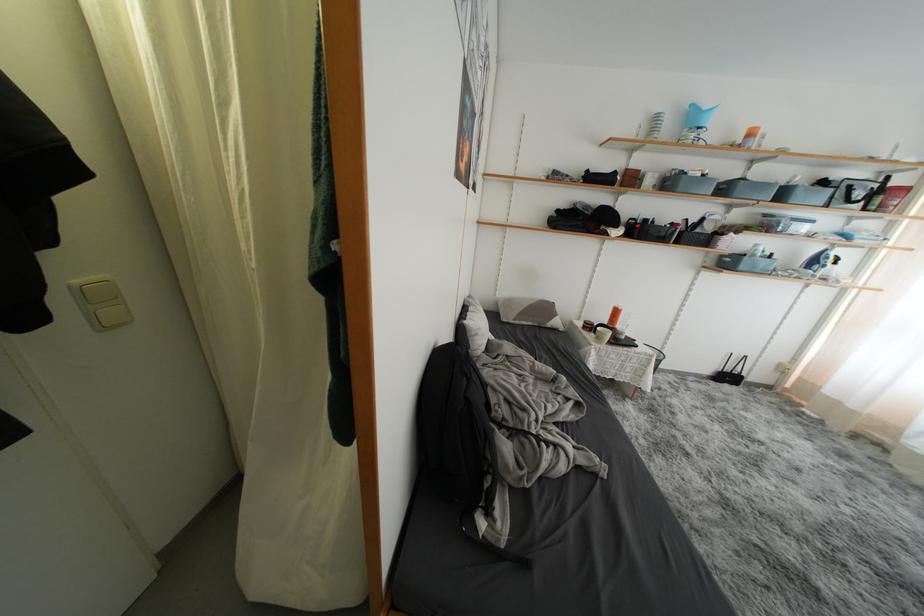
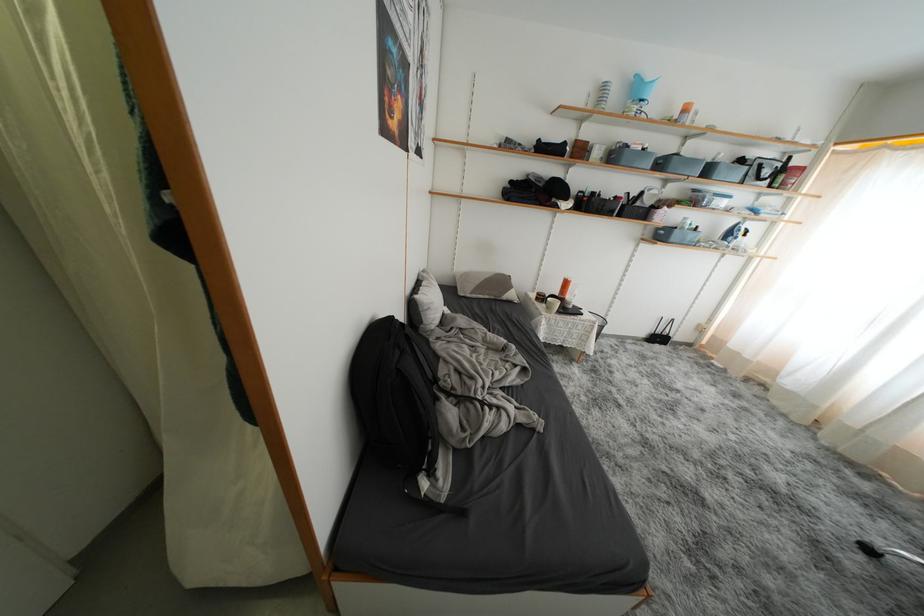
The point at [470,385] is marked in the first image. Where is the corresponding point in the second image?

(404, 357)